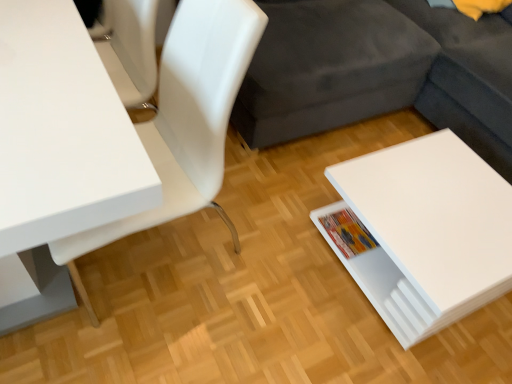
Find the location of a particular element. The height and width of the screenshot is (384, 512). free region under white glossy chair at upper left (from a real-world perspective) is located at coordinates (179, 249).